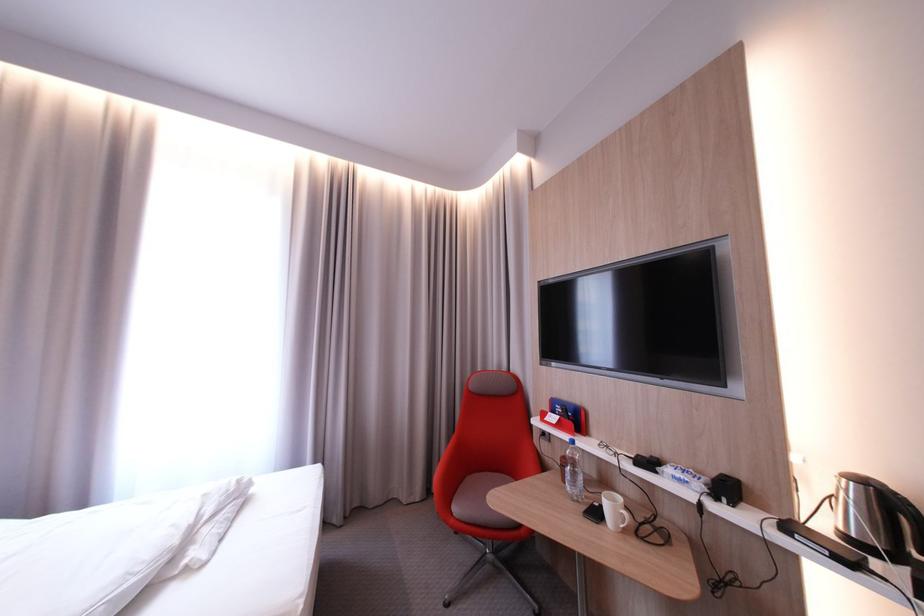
You are a GUI agent. You are given a task and a screenshot of the screen. Output one action in this format:
    pyautogui.click(x=<x>, y=<y>)
    Task: Click on the black eyeglasses
    The height and width of the screenshot is (616, 924).
    Given the screenshot: What is the action you would take?
    pyautogui.click(x=609, y=448)